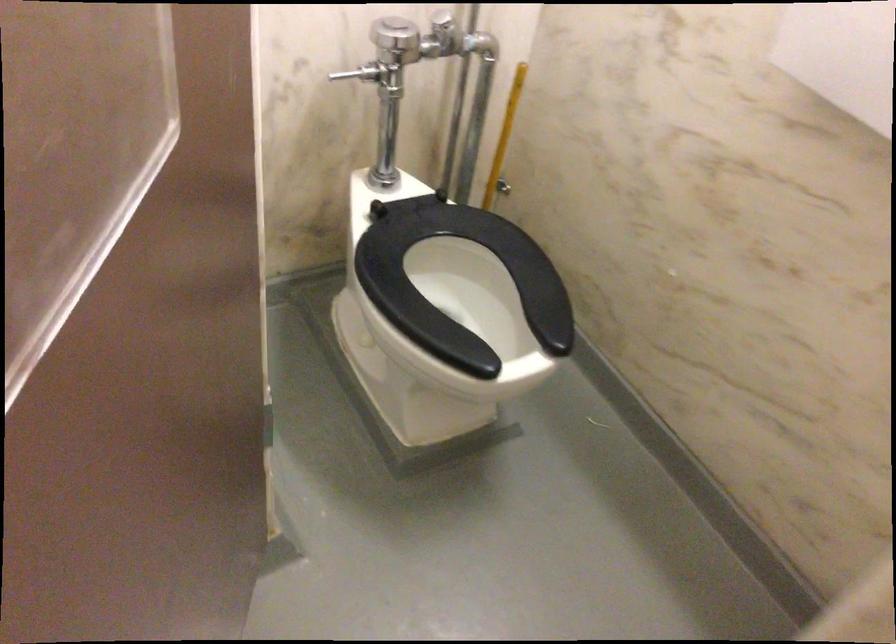
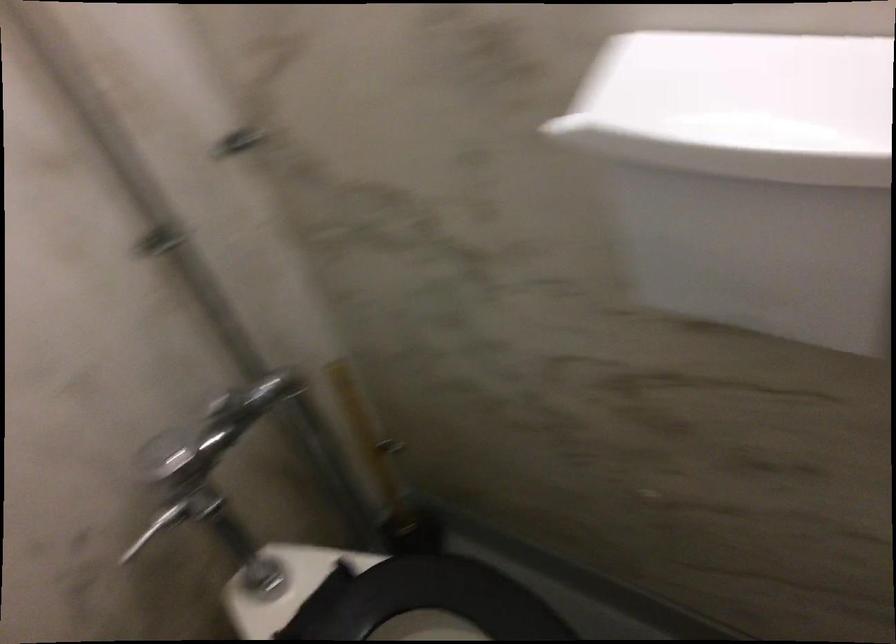
Question: How did the camera likely rotate?

Choices:
 (A) Left
 (B) Right
 (C) Up
 (D) Down

Answer: (B)